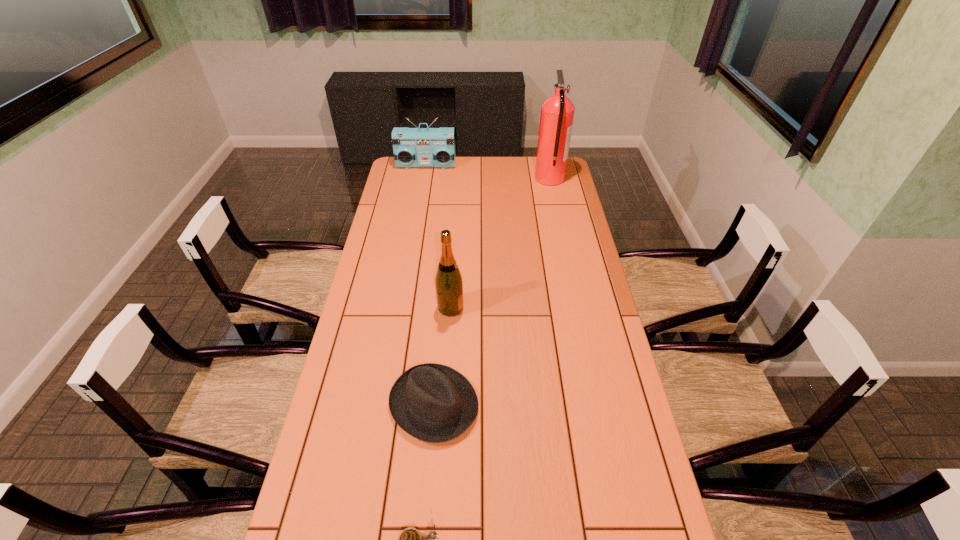
This screenshot has width=960, height=540. Find the location of `fire extinguisher`. fire extinguisher is located at coordinates point(557,112).

Image resolution: width=960 pixels, height=540 pixels. In order to click on the tallest object in this screenshot , I will do pos(557,112).

Find the location of a particular element. This screenshot has width=960, height=540. wine bottle is located at coordinates (448, 282).

Identify the location of the second tallest object. (448, 282).

You are a GUI agent. You are given a task and a screenshot of the screen. Output one action in this format:
    pyautogui.click(x=<x>, y=<y>)
    Task: Click on the radio receiver
    The image size is (960, 540).
    Given the screenshot: What is the action you would take?
    tap(413, 147)

You are a GUI agent. You are given a task and a screenshot of the screen. Output one action in this format:
    pyautogui.click(x=<x>, y=<y>)
    Task: Click on the fedora
    The image size is (960, 540).
    Given the screenshot: What is the action you would take?
    pyautogui.click(x=434, y=403)

Identify the location of free spot located 0.380m at the nozzle of the rightmost object. (458, 179).

The width and height of the screenshot is (960, 540). Identify the location of vacant space located 0.290m at the nozzle of the rightmost object. (476, 179).

At what (x,y) coordinates should I click in order to perform the action: click on free region located 0.210m at the nozzle of the rightmost object. Please return your answer as a coordinate pair (x, y). Looking at the image, I should click on (492, 179).

Locate an element on the screen. free location located on the front-facing side of the third nearest object is located at coordinates (497, 307).